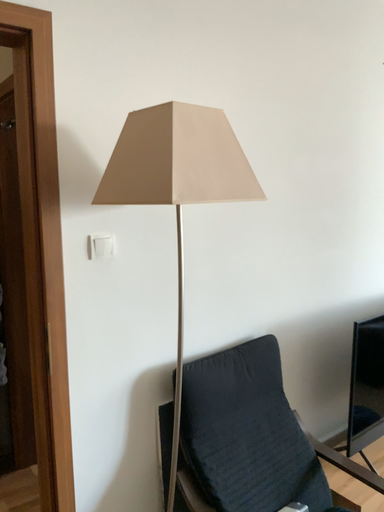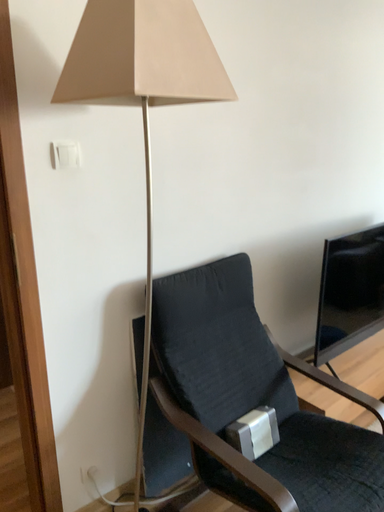
Question: Which way did the camera rotate in the video?

Choices:
 (A) rotated upward
 (B) rotated downward

Answer: (B)